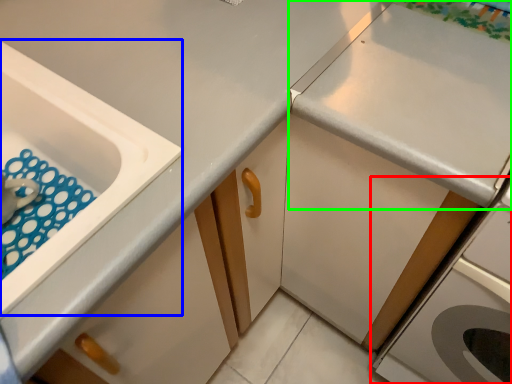
Question: Considering the real-world distances, which object is closest to home appliance (highlighted by a red box)? sink (highlighted by a blue box) or countertop (highlighted by a green box).

Choices:
 (A) sink
 (B) countertop

Answer: (B)